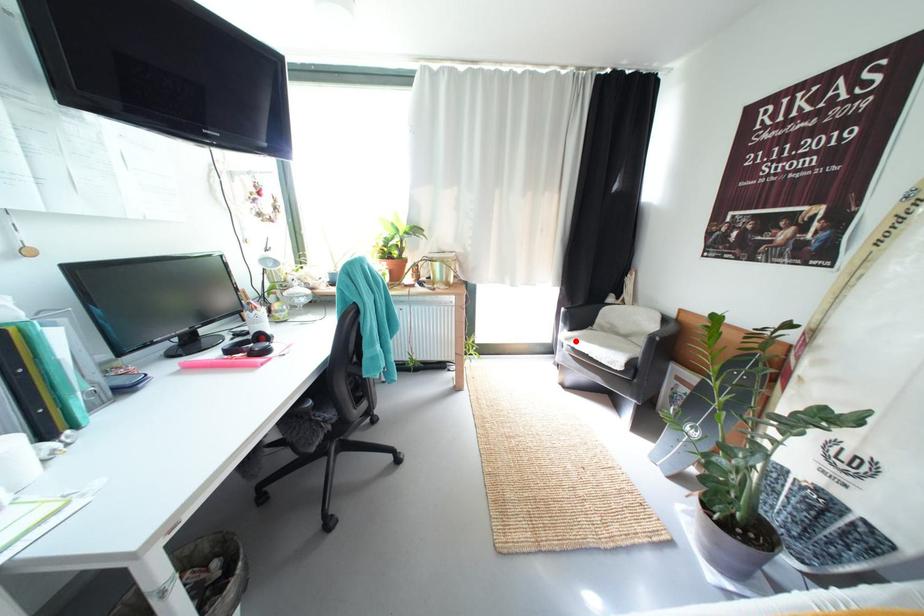
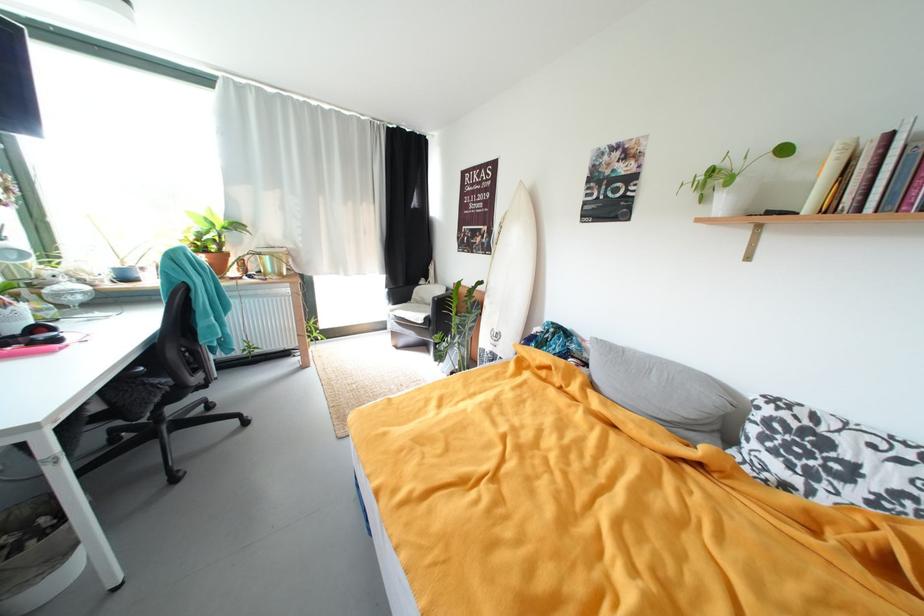
Where in the second image is the point corresponding to the highlighted location from the first image?

(399, 313)